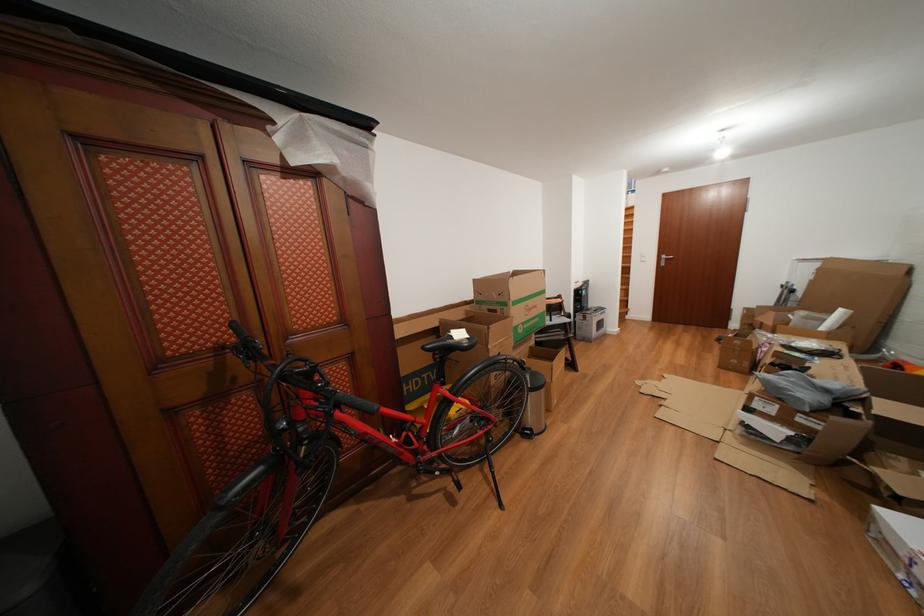
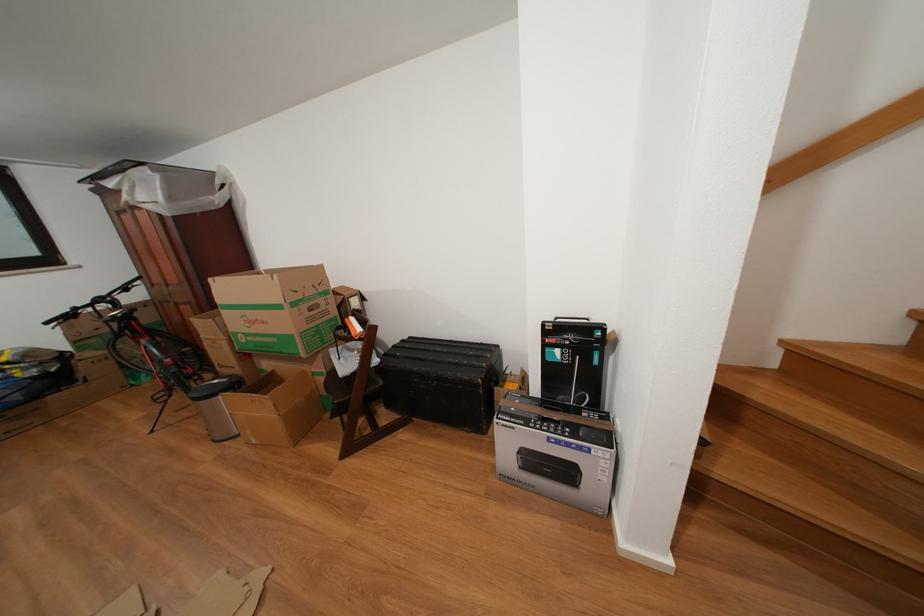
The point at (543, 312) is marked in the first image. Where is the corresponding point in the second image?

(272, 328)